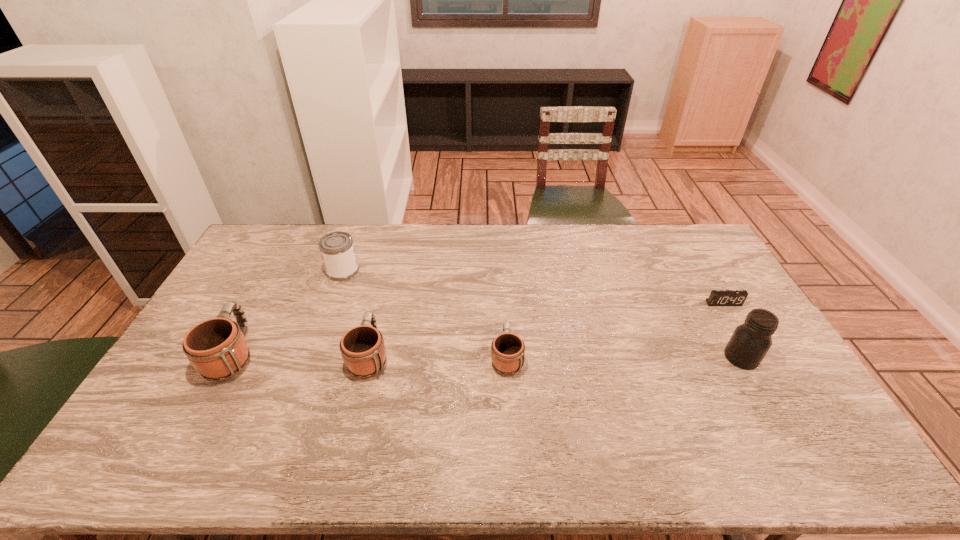
Please point out where to position a new mug on the right to maintain spacing. Please provide its 2D coordinates. Your answer should be formatted as a tuple, i.e. [(x, y)], where the tuple contains the x and y coordinates of a point satisfying the conditions above.

[(644, 358)]